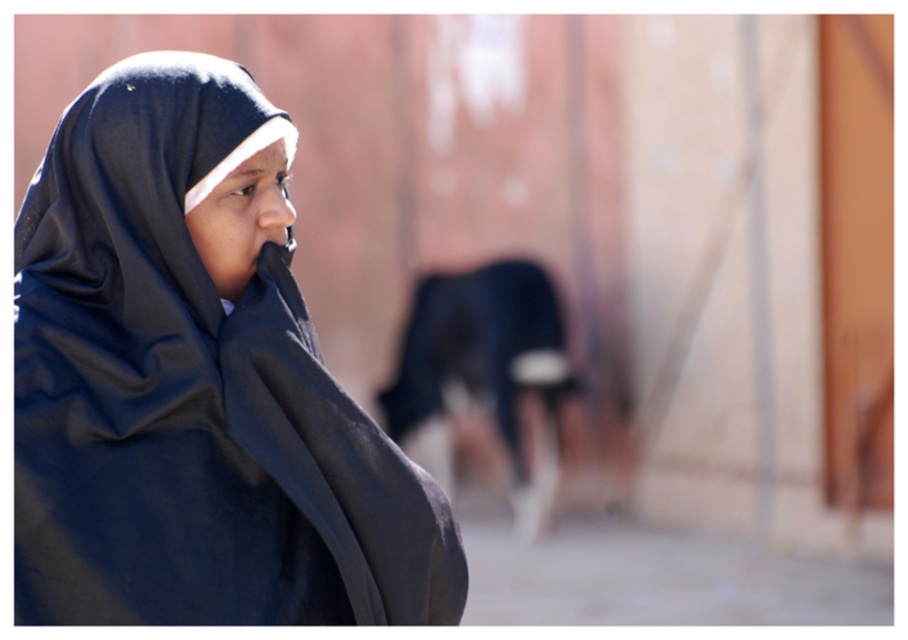
Question: Is matte black hijab at left thinner than dark blue fur at center?

Choices:
 (A) yes
 (B) no

Answer: (A)

Question: Can you confirm if matte black hijab at left is positioned to the right of dark blue fur at center?

Choices:
 (A) no
 (B) yes

Answer: (A)

Question: Which of the following is the farthest from the observer?

Choices:
 (A) dark blue fur at center
 (B) matte black hijab at left

Answer: (A)

Question: Which object is closer to the camera taking this photo?

Choices:
 (A) dark blue fur at center
 (B) matte black hijab at left

Answer: (B)

Question: Which of the following is the farthest from the observer?

Choices:
 (A) matte black hijab at left
 (B) dark blue fur at center

Answer: (B)

Question: Does matte black hijab at left lie in front of dark blue fur at center?

Choices:
 (A) no
 (B) yes

Answer: (B)